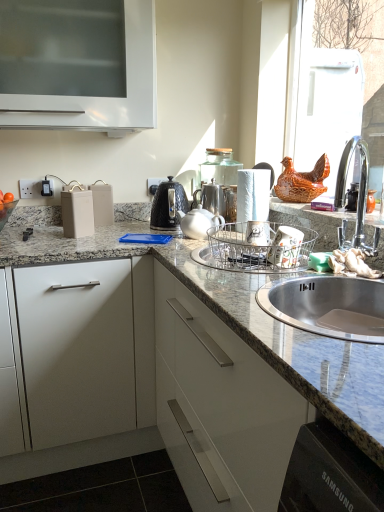
Question: Considering the relative positions of metallic silver dish rack at sink, which is the second appliance from left to right, and white matte drawer at left in the image provided, is metallic silver dish rack at sink, which is the second appliance from left to right, in front of white matte drawer at left?

Choices:
 (A) no
 (B) yes

Answer: (B)

Question: Considering the relative sizes of metallic silver dish rack at sink, which is the second appliance from left to right, and white matte drawer at left in the image provided, is metallic silver dish rack at sink, which is the second appliance from left to right, taller than white matte drawer at left?

Choices:
 (A) no
 (B) yes

Answer: (A)

Question: From the image's perspective, would you say metallic silver dish rack at sink, which is the second appliance from left to right, is shown under white matte drawer at left?

Choices:
 (A) yes
 (B) no

Answer: (B)

Question: Would you say metallic silver dish rack at sink, which is counted as the 3th appliance, starting from the right, is outside white matte drawer at left?

Choices:
 (A) yes
 (B) no

Answer: (A)

Question: Is metallic silver dish rack at sink, which is the second appliance from left to right, smaller than white matte drawer at left?

Choices:
 (A) yes
 (B) no

Answer: (A)

Question: Is point (264, 237) closer or farther from the camera than point (359, 55)?

Choices:
 (A) closer
 (B) farther

Answer: (A)

Question: Based on their sizes in the image, would you say metallic silver dish rack at sink, which is counted as the 3th appliance, starting from the right, is bigger or smaller than white glossy refrigerator at upper right, the fourth appliance when ordered from left to right?

Choices:
 (A) small
 (B) big

Answer: (A)

Question: Considering their positions, is metallic silver dish rack at sink, which is counted as the 3th appliance, starting from the right, located in front of or behind white glossy refrigerator at upper right, the fourth appliance when ordered from left to right?

Choices:
 (A) front
 (B) behind

Answer: (A)

Question: Considering the positions of metallic silver dish rack at sink, which is counted as the 3th appliance, starting from the right, and white glossy refrigerator at upper right, the fourth appliance when ordered from left to right, in the image, is metallic silver dish rack at sink, which is counted as the 3th appliance, starting from the right, wider or thinner than white glossy refrigerator at upper right, the fourth appliance when ordered from left to right,?

Choices:
 (A) wide
 (B) thin

Answer: (A)

Question: In the image, is white glossy refrigerator at upper right, the first appliance viewed from the right, on the left side or the right side of satin silver coffee pot at center, the 2th coffeepot when ordered from left to right?

Choices:
 (A) right
 (B) left

Answer: (A)

Question: From the image's perspective, relative to satin silver coffee pot at center, the 2th coffeepot when ordered from left to right, is white glossy refrigerator at upper right, the first appliance viewed from the right, above or below?

Choices:
 (A) below
 (B) above

Answer: (B)

Question: In terms of height, does white glossy refrigerator at upper right, the fourth appliance when ordered from left to right, look taller or shorter compared to satin silver coffee pot at center, the 2th coffeepot when ordered from left to right?

Choices:
 (A) tall
 (B) short

Answer: (A)

Question: Would you say white glossy refrigerator at upper right, the first appliance viewed from the right, is inside or outside satin silver coffee pot at center, the 2th coffeepot when ordered from left to right?

Choices:
 (A) inside
 (B) outside

Answer: (B)

Question: Considering the positions of white matte paper towel at center and metallic silver dish rack at sink, which is the second appliance from left to right, in the image, is white matte paper towel at center bigger or smaller than metallic silver dish rack at sink, which is the second appliance from left to right,?

Choices:
 (A) big
 (B) small

Answer: (B)

Question: Is white matte paper towel at center spatially inside metallic silver dish rack at sink, which is the second appliance from left to right, or outside of it?

Choices:
 (A) outside
 (B) inside

Answer: (A)